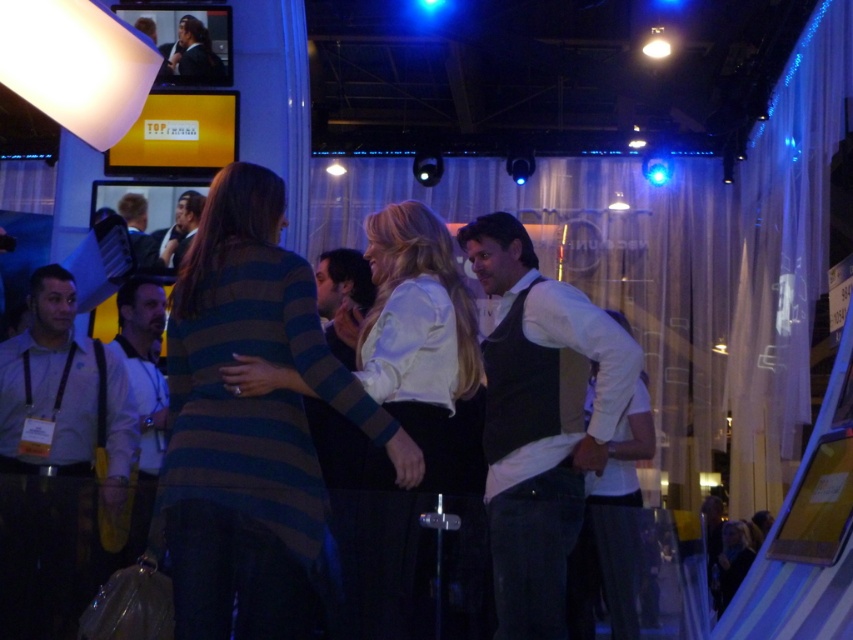
Question: Does white matte shirt at center appear on the right side of light brown leather jacket at left?

Choices:
 (A) yes
 (B) no

Answer: (A)

Question: Which point is farther to the camera?

Choices:
 (A) (131, 220)
 (B) (234, 163)
 (C) (462, 356)
 (D) (183, 257)

Answer: (A)

Question: Estimate the real-world distances between objects in this image. Which object is closer to the striped sweater at center?

Choices:
 (A) light gray shirt at left
 (B) white satin blouse at center

Answer: (B)

Question: Can you confirm if white matte shirt at center is smaller than dark blue fabric jacket at left?

Choices:
 (A) yes
 (B) no

Answer: (B)

Question: Is white satin blouse at center below white matte shirt at center?

Choices:
 (A) yes
 (B) no

Answer: (B)

Question: Which point appears closest to the camera in this image?

Choices:
 (A) (637, 625)
 (B) (148, 472)
 (C) (492, 273)

Answer: (C)